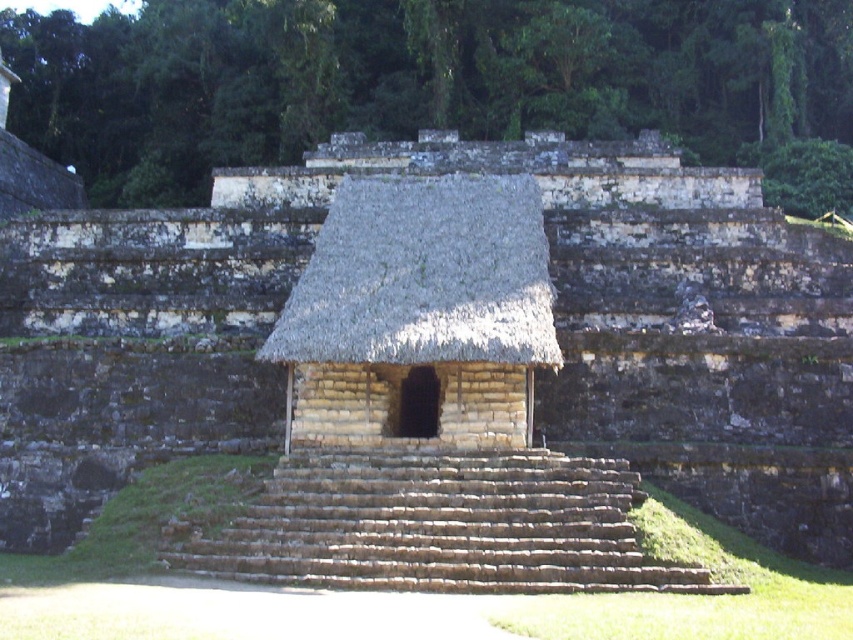
Question: Does thatched straw hut at center come behind brown stone stairs at center?

Choices:
 (A) no
 (B) yes

Answer: (B)

Question: Which object is the closest to the stone amphitheater at center?

Choices:
 (A) thatched straw hut at center
 (B) brown stone stairs at center

Answer: (A)

Question: Among these points, which one is nearest to the camera?

Choices:
 (A) (479, 589)
 (B) (434, 250)
 (C) (210, 412)

Answer: (A)

Question: Among these objects, which one is farthest from the camera?

Choices:
 (A) stone amphitheater at center
 (B) brown stone stairs at center

Answer: (A)

Question: Is stone amphitheater at center to the left of brown stone stairs at center from the viewer's perspective?

Choices:
 (A) yes
 (B) no

Answer: (A)

Question: Does stone amphitheater at center appear on the right side of thatched straw hut at center?

Choices:
 (A) no
 (B) yes

Answer: (A)